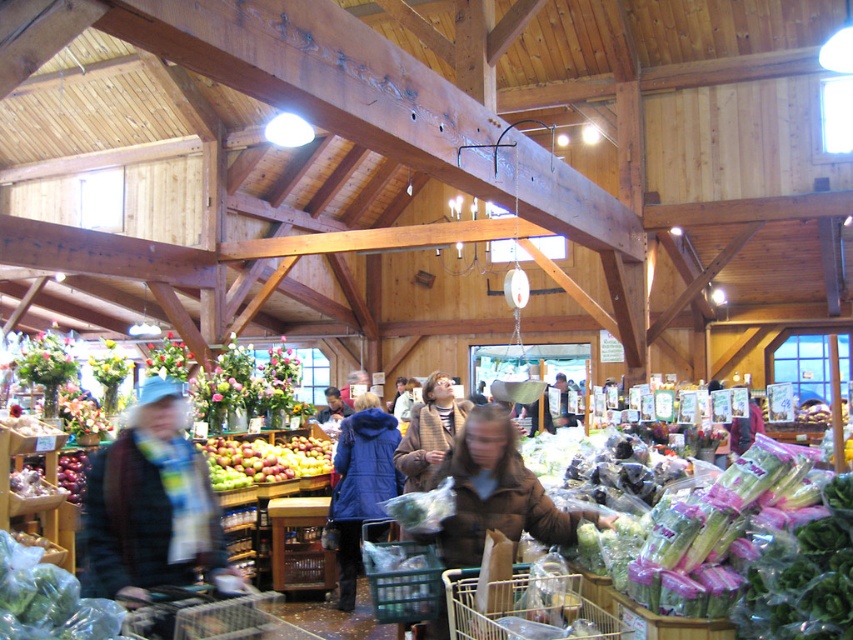
Question: Estimate the real-world distances between objects in this image. Which object is closer to the blue woolen scarf at left?

Choices:
 (A) metallic wire basket at lower center
 (B) green matte apples at center
 (C) blue matte coat at center

Answer: (A)

Question: Does brown fuzzy coat at center have a greater width compared to metallic wire basket at lower center?

Choices:
 (A) no
 (B) yes

Answer: (B)

Question: Which object appears closest to the camera in this image?

Choices:
 (A) blue woolen scarf at left
 (B) blue matte coat at center
 (C) green matte apples at center
 (D) metallic wire basket at lower center

Answer: (D)

Question: Does blue woolen scarf at left come in front of green matte apples at center?

Choices:
 (A) yes
 (B) no

Answer: (A)

Question: Is metallic wire basket at lower center below green matte apples at center?

Choices:
 (A) no
 (B) yes

Answer: (A)

Question: Estimate the real-world distances between objects in this image. Which object is closer to the metallic wire basket at lower center?

Choices:
 (A) brown fuzzy coat at center
 (B) blue matte coat at center
 (C) blue woolen scarf at left
 (D) green matte apples at center

Answer: (A)